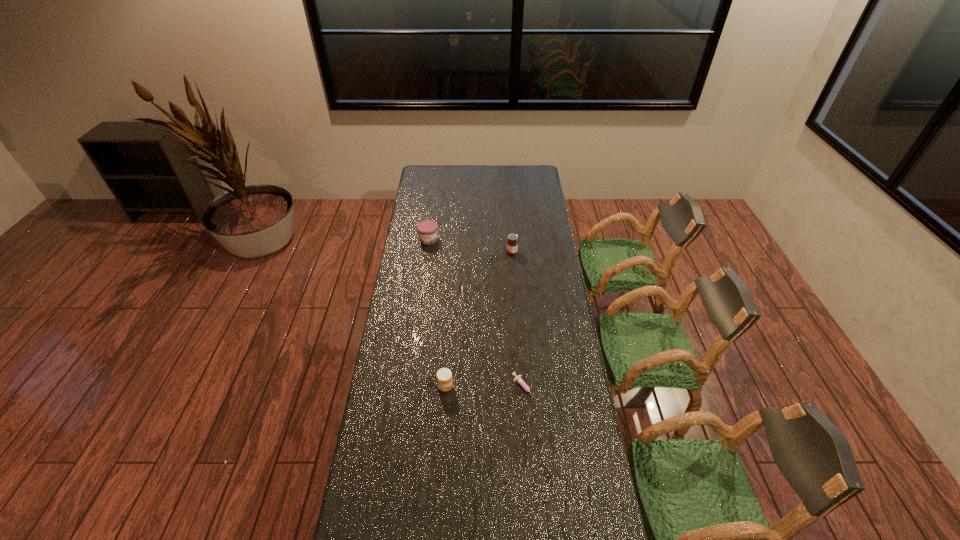
At what (x,y) coordinates should I click in order to perform the action: click on free point between the farthest jam and the syringe. Please return your answer as a coordinate pair (x, y). Looking at the image, I should click on (476, 314).

Image resolution: width=960 pixels, height=540 pixels. I want to click on empty space between the shortest object and the leftmost jam, so pyautogui.click(x=476, y=314).

In order to click on empty space that is in between the second jam from left to right and the second nearest jam in this screenshot , I will do `click(478, 320)`.

This screenshot has width=960, height=540. I want to click on free space between the second object from left to right and the syringe, so click(x=485, y=388).

Image resolution: width=960 pixels, height=540 pixels. Find the location of `unoccupied position between the farthest object and the nearest jam`. unoccupied position between the farthest object and the nearest jam is located at coordinates (437, 313).

The height and width of the screenshot is (540, 960). Find the location of `vacant area that lies between the syringe and the nearest jam`. vacant area that lies between the syringe and the nearest jam is located at coordinates (485, 388).

The image size is (960, 540). What are the coordinates of `free space between the syringe and the nearest jam` in the screenshot? It's located at (485, 388).

Where is `free space between the shortest object and the farthest object`? Image resolution: width=960 pixels, height=540 pixels. free space between the shortest object and the farthest object is located at coordinates (476, 314).

I want to click on unoccupied area between the leftmost object and the second jam from right to left, so click(x=437, y=313).

Select which object appears as the closest to the leftmost jam. Please provide its 2D coordinates. Your answer should be formatted as a tuple, i.e. [(x, y)], where the tuple contains the x and y coordinates of a point satisfying the conditions above.

[(512, 244)]